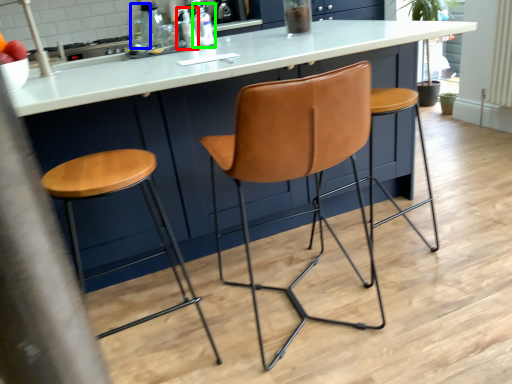
Question: Which is nearer to the bottle (highlighted by a red box)? bottle (highlighted by a blue box) or bottle (highlighted by a green box).

Choices:
 (A) bottle
 (B) bottle

Answer: (B)